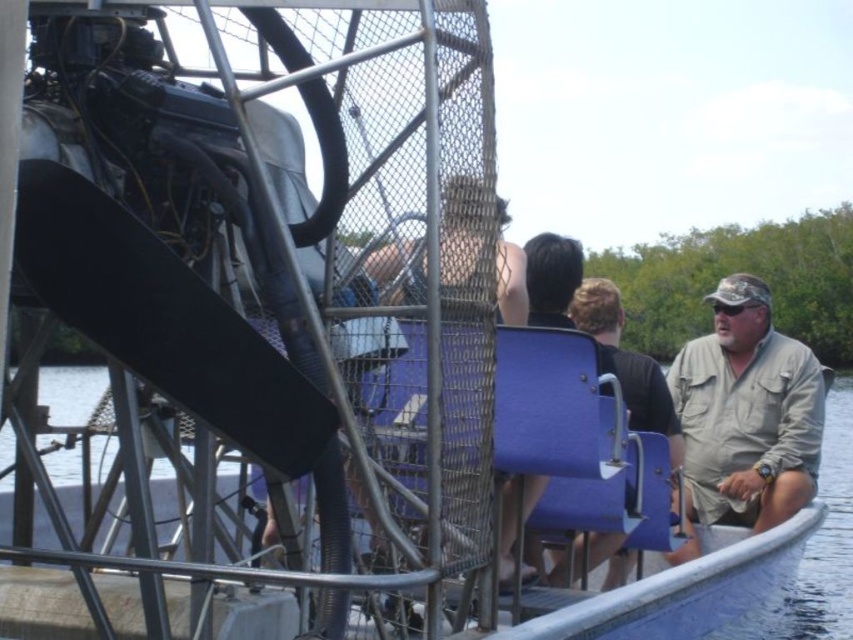
Does khaki fabric shirt at right have a lesser height compared to blue plastic seat at center?

Correct, khaki fabric shirt at right is not as tall as blue plastic seat at center.

Based on the photo, who is shorter, khaki fabric shirt at right or blue plastic seat at center?

khaki fabric shirt at right

Does point (749, 371) lie behind point (56, 412)?

No, it is not.

Find the location of a particular element. The width and height of the screenshot is (853, 640). khaki fabric shirt at right is located at coordinates (747, 412).

Does khaki fabric shirt at right appear under light brown leather jacket at center?

Indeed, khaki fabric shirt at right is positioned under light brown leather jacket at center.

Is khaki fabric shirt at right wider than light brown leather jacket at center?

Yes.

Does point (799, 432) come behind point (622, 358)?

Yes, it is.

Identify the location of khaki fabric shirt at right. (747, 412).

Which is more to the right, blue plastic seat at center or light brown leather jacket at center?

light brown leather jacket at center

Between point (828, 470) and point (621, 387), which one is positioned behind?

Positioned behind is point (828, 470).

Locate an element on the screen. The image size is (853, 640). blue plastic seat at center is located at coordinates (822, 544).